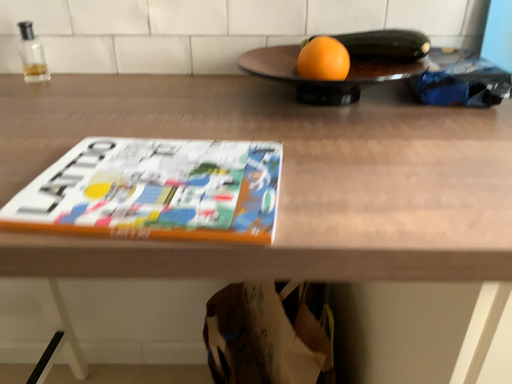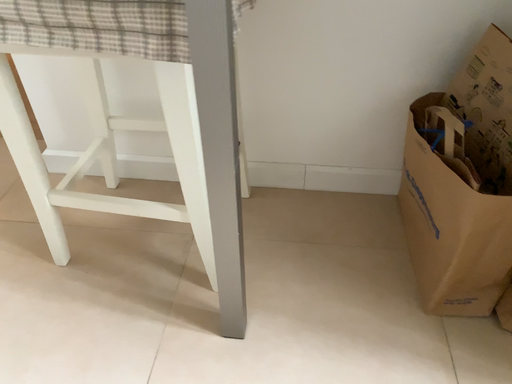
Question: How did the camera likely rotate when shooting the video?

Choices:
 (A) rotated upward
 (B) rotated downward

Answer: (B)